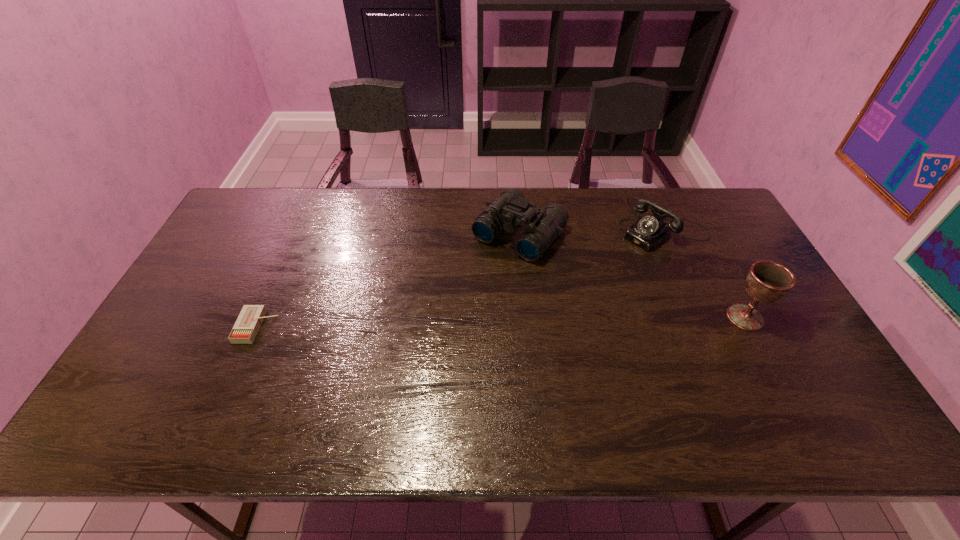
I want to click on vacant space in between the telephone and the chalice, so click(x=705, y=274).

Where is `free point between the binoculars and the matchbox`? free point between the binoculars and the matchbox is located at coordinates (388, 280).

Find the location of a particular element. Image resolution: width=960 pixels, height=540 pixels. empty space that is in between the second object from left to right and the chalice is located at coordinates click(633, 275).

Where is `vacant point located between the binoculars and the chalice`? This screenshot has width=960, height=540. vacant point located between the binoculars and the chalice is located at coordinates (633, 275).

Locate which object ranks second in proximity to the binoculars. Please provide its 2D coordinates. Your answer should be formatted as a tuple, i.e. [(x, y)], where the tuple contains the x and y coordinates of a point satisfying the conditions above.

[(767, 281)]

Identify which object is located as the nearest to the chalice. Please provide its 2D coordinates. Your answer should be formatted as a tuple, i.e. [(x, y)], where the tuple contains the x and y coordinates of a point satisfying the conditions above.

[(649, 232)]

The width and height of the screenshot is (960, 540). I want to click on blank space that satisfies the following two spatial constraints: 1. on the back side of the third tallest object; 2. on the left side of the binoculars, so click(519, 231).